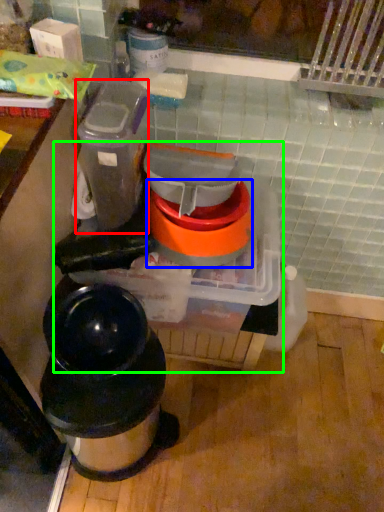
Question: Which is nearer to the appliance (highlighted by a red box)? appliance (highlighted by a blue box) or appliance (highlighted by a green box).

Choices:
 (A) appliance
 (B) appliance

Answer: (A)